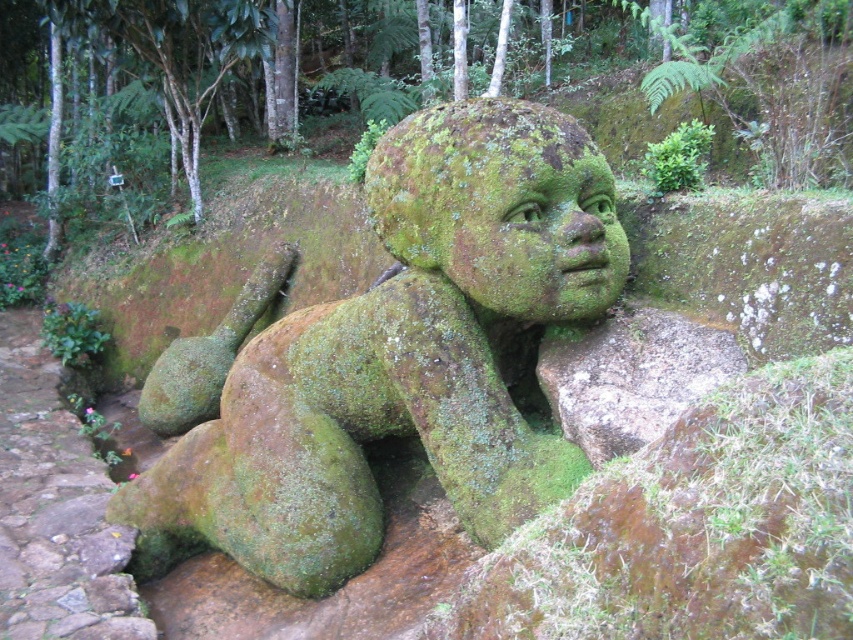
Between green mossy head at center and brown stone path at lower left, which one appears on the left side from the viewer's perspective?

From the viewer's perspective, brown stone path at lower left appears more on the left side.

Is green mossy head at center in front of brown stone path at lower left?

No, it is not.

Does point (595, 285) come closer to viewer compared to point (103, 561)?

Yes, point (595, 285) is closer to viewer.

The image size is (853, 640). I want to click on green mossy head at center, so click(x=502, y=205).

Between green mossy statue at center and green mossy rock at lower center, which one appears on the left side from the viewer's perspective?

Positioned to the left is green mossy statue at center.

Between green mossy statue at center and green mossy rock at lower center, which one is positioned higher?

green mossy rock at lower center is higher up.

This screenshot has width=853, height=640. What do you see at coordinates (390, 356) in the screenshot?
I see `green mossy statue at center` at bounding box center [390, 356].

At what (x,y) coordinates should I click in order to perform the action: click on green mossy statue at center. Please return your answer as a coordinate pair (x, y). The width and height of the screenshot is (853, 640). Looking at the image, I should click on 390,356.

Can you confirm if green mossy head at center is bigger than green mossy rock at lower center?

Indeed, green mossy head at center has a larger size compared to green mossy rock at lower center.

From the picture: Is green mossy head at center below green mossy rock at lower center?

No.

Is point (473, 264) farther from viewer compared to point (570, 353)?

No, (473, 264) is closer to viewer.

The width and height of the screenshot is (853, 640). Find the location of `green mossy head at center`. green mossy head at center is located at coordinates (502, 205).